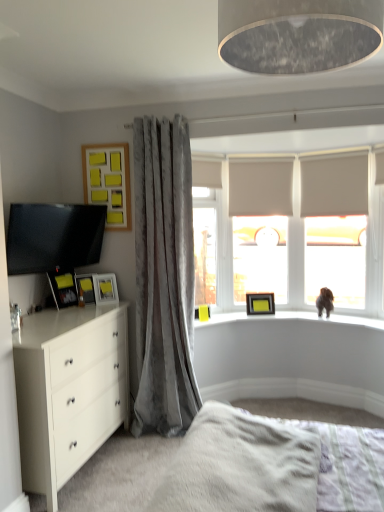
Where is `free location to the left of matte yellow picture frame at upper center, the 5th picture frame in the left-to-right sequence`? free location to the left of matte yellow picture frame at upper center, the 5th picture frame in the left-to-right sequence is located at coordinates (236, 315).